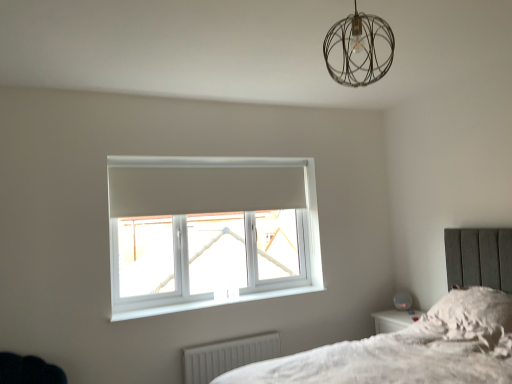
Describe the element at coordinates (212, 303) in the screenshot. I see `white plastic window sill at lower center` at that location.

This screenshot has width=512, height=384. In order to click on white plastic window at center in this screenshot , I will do `click(216, 251)`.

Locate an element on the screen. The image size is (512, 384). fluffy white pillow at lower right is located at coordinates (472, 318).

Does fluffy white pillow at lower right have a lesser height compared to white plastic window sill at lower center?

Incorrect, the height of fluffy white pillow at lower right does not fall short of that of white plastic window sill at lower center.

Does fluffy white pillow at lower right have a smaller size compared to white plastic window sill at lower center?

Incorrect, fluffy white pillow at lower right is not smaller in size than white plastic window sill at lower center.

Does fluffy white pillow at lower right have a lesser width compared to white plastic window sill at lower center?

In fact, fluffy white pillow at lower right might be wider than white plastic window sill at lower center.

The height and width of the screenshot is (384, 512). In order to click on pillow on the right side of white plastic window sill at lower center in this screenshot , I will do `click(472, 318)`.

How different are the orientations of white ribbed radiator at lower center and metallic wire sphere at upper center in degrees?

There is a 88-degree angle between the facing directions of white ribbed radiator at lower center and metallic wire sphere at upper center.

Considering the sizes of objects white ribbed radiator at lower center and metallic wire sphere at upper center in the image provided, who is smaller, white ribbed radiator at lower center or metallic wire sphere at upper center?

white ribbed radiator at lower center is smaller.

Is point (219, 374) closer to viewer compared to point (374, 55)?

No, (219, 374) is behind (374, 55).

Based on the photo, from a real-world perspective, relative to white plastic window at center, is white plastic window sill at lower center vertically above or below?

white plastic window sill at lower center is below white plastic window at center.

Is white plastic window sill at lower center looking in the opposite direction of white plastic window at center?

No, white plastic window sill at lower center is not facing the opposite direction of white plastic window at center.

Which object is closer to the camera taking this photo, white plastic window sill at lower center or white plastic window at center?

white plastic window sill at lower center.

Between white plastic window sill at lower center and white plastic window at center, which one has more height?

white plastic window at center is taller.

From the picture: Could you tell me if white plastic window sill at lower center is facing fluffy white pillow at lower right?

No, white plastic window sill at lower center is not aimed at fluffy white pillow at lower right.

Which object is thinner, white plastic window sill at lower center or fluffy white pillow at lower right?

Thinner between the two is white plastic window sill at lower center.

Does white plastic window sill at lower center contain fluffy white pillow at lower right?

No, fluffy white pillow at lower right is not surrounded by white plastic window sill at lower center.

Can you confirm if white plastic window sill at lower center is taller than fluffy white pillow at lower right?

No, white plastic window sill at lower center is not taller than fluffy white pillow at lower right.

Measure the distance between metallic wire sphere at upper center and white plastic window sill at lower center.

metallic wire sphere at upper center and white plastic window sill at lower center are 7.01 feet apart.

Based on their sizes in the image, would you say metallic wire sphere at upper center is bigger or smaller than white plastic window sill at lower center?

Considering their sizes, metallic wire sphere at upper center takes up more space than white plastic window sill at lower center.

From the image's perspective, relative to white plastic window sill at lower center, is metallic wire sphere at upper center above or below?

Based on their image positions, metallic wire sphere at upper center is located above white plastic window sill at lower center.

Could white plastic window sill at lower center be considered to be inside metallic wire sphere at upper center?

No, white plastic window sill at lower center is not a part of metallic wire sphere at upper center.

Is white ribbed radiator at lower center not within white plastic window at center?

Yes, white ribbed radiator at lower center is outside of white plastic window at center.

Looking at this image, considering the positions of objects white ribbed radiator at lower center and white plastic window at center in the image provided, who is behind, white ribbed radiator at lower center or white plastic window at center?

Positioned behind is white plastic window at center.

Looking at the image, does white ribbed radiator at lower center seem bigger or smaller compared to white plastic window at center?

Considering their sizes, white ribbed radiator at lower center takes up less space than white plastic window at center.

Is white ribbed radiator at lower center next to white plastic window at center and touching it?

No, white ribbed radiator at lower center is not touching white plastic window at center.

Between white ribbed radiator at lower center and white plastic window sill at lower center, which one has smaller size?

white plastic window sill at lower center is smaller.

Looking at this image, which is in front, white ribbed radiator at lower center or white plastic window sill at lower center?

white plastic window sill at lower center is in front.

Is white ribbed radiator at lower center facing away from white plastic window sill at lower center?

No, white ribbed radiator at lower center's orientation is not away from white plastic window sill at lower center.

From the image's perspective, which is above, white ribbed radiator at lower center or white plastic window sill at lower center?

white plastic window sill at lower center appears higher in the image.

What are the coordinates of `pillow that appears above the white plastic window sill at lower center (from the image's perspective)` in the screenshot? It's located at (472, 318).

Locate an element on the screen. radiator on the left of metallic wire sphere at upper center is located at coordinates (228, 356).

When comparing their distances from white plastic window sill at lower center, does white plastic window at center or fluffy white pillow at lower right seem further?

fluffy white pillow at lower right lies further to white plastic window sill at lower center than the other object.

Looking at the image, which one is located further to white plastic window at center, white ribbed radiator at lower center or fluffy white pillow at lower right?

fluffy white pillow at lower right is further to white plastic window at center.

Looking at the image, which one is located further to white ribbed radiator at lower center, fluffy white pillow at lower right or white plastic window sill at lower center?

fluffy white pillow at lower right is positioned further to the anchor white ribbed radiator at lower center.

Based on the photo, considering their positions, is white plastic window at center positioned further to fluffy white pillow at lower right than metallic wire sphere at upper center?

metallic wire sphere at upper center is further to fluffy white pillow at lower right.

Estimate the real-world distances between objects in this image. Which object is further from white plastic window sill at lower center, white plastic window at center or white ribbed radiator at lower center?

white ribbed radiator at lower center.

Looking at the image, which one is located closer to metallic wire sphere at upper center, white plastic window at center or white ribbed radiator at lower center?

Among the two, white plastic window at center is located nearer to metallic wire sphere at upper center.

In the scene shown: Considering their positions, is white plastic window at center positioned further to white ribbed radiator at lower center than white plastic window sill at lower center?

white plastic window at center is further to white ribbed radiator at lower center.

From the image, which object appears to be nearer to metallic wire sphere at upper center, fluffy white pillow at lower right or white plastic window sill at lower center?

fluffy white pillow at lower right is positioned closer to the anchor metallic wire sphere at upper center.

You are a GUI agent. You are given a task and a screenshot of the screen. Output one action in this format:
    pyautogui.click(x=<x>, y=<y>)
    Task: Click on the radiator located between white plastic window sill at lower center and fluffy white pillow at lower right in the left-right direction
    This screenshot has width=512, height=384.
    Given the screenshot: What is the action you would take?
    pyautogui.click(x=228, y=356)

Image resolution: width=512 pixels, height=384 pixels. I want to click on radiator between white plastic window at center and fluffy white pillow at lower right, so click(228, 356).

Identify the location of window sill between metallic wire sphere at upper center and white ribbed radiator at lower center from top to bottom. This screenshot has width=512, height=384. (212, 303).

Identify the location of window sill between metallic wire sphere at upper center and white plastic window at center in the front-back direction. (212, 303).